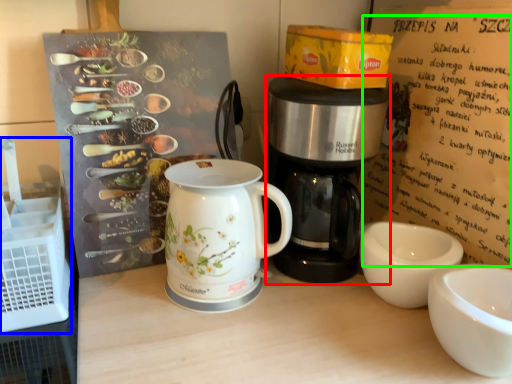
Question: Estimate the real-world distances between objects in this image. Which object is farther from coffee maker (highlighted by a red box), crate (highlighted by a blue box) or writing (highlighted by a green box)?

Choices:
 (A) crate
 (B) writing

Answer: (A)